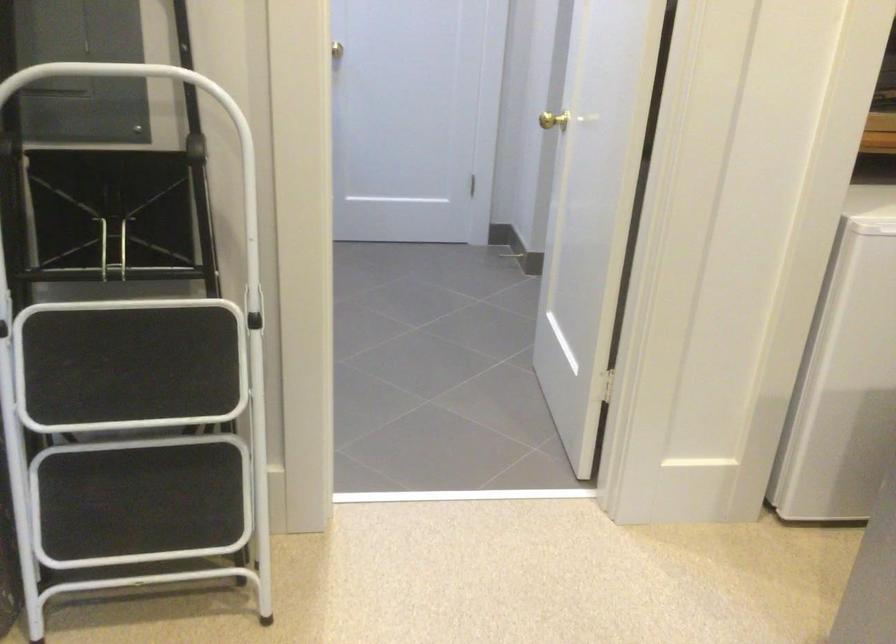
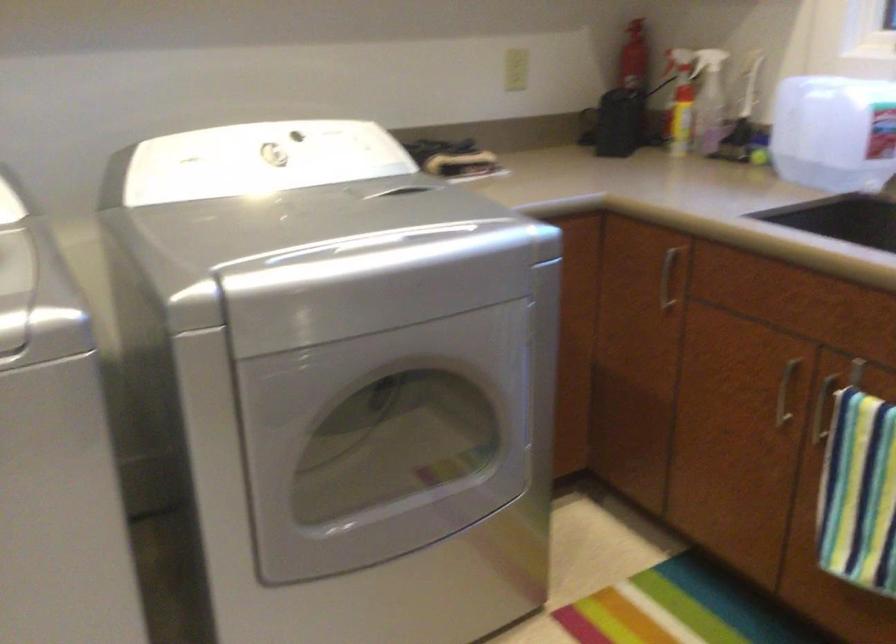
Consider the image. How did the camera likely rotate?

The camera rotated toward right-down.